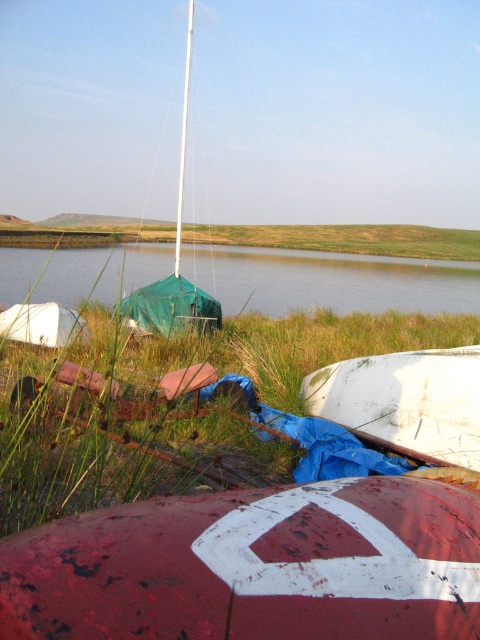
Question: Can you confirm if red painted buoy at center is thinner than green fabric water at center?

Choices:
 (A) yes
 (B) no

Answer: (A)

Question: Does green grass at center have a smaller size compared to white matte boat at lower right?

Choices:
 (A) yes
 (B) no

Answer: (B)

Question: Which of the following is the farthest from the observer?

Choices:
 (A) white smooth mast at center
 (B) red painted buoy at center
 (C) green grass at center
 (D) white matte boat at lower right

Answer: (A)

Question: Among these objects, which one is farthest from the camera?

Choices:
 (A) red painted buoy at center
 (B) white smooth mast at center

Answer: (B)

Question: Which point is farther to the camera?

Choices:
 (A) green fabric water at center
 (B) red painted buoy at center
 (C) white matte boat at lower right

Answer: (A)

Question: Can you confirm if red painted buoy at center is positioned to the right of white smooth mast at center?

Choices:
 (A) yes
 (B) no

Answer: (A)